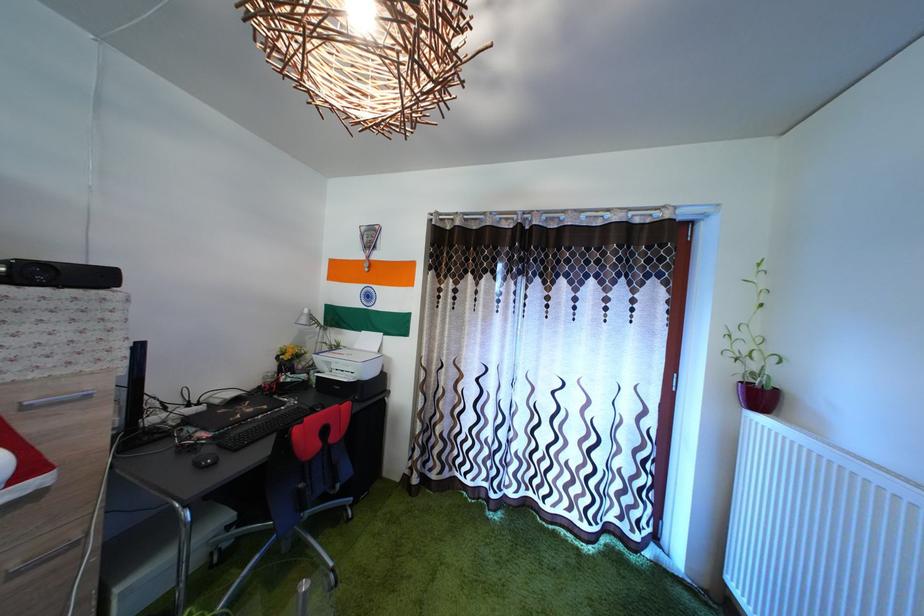
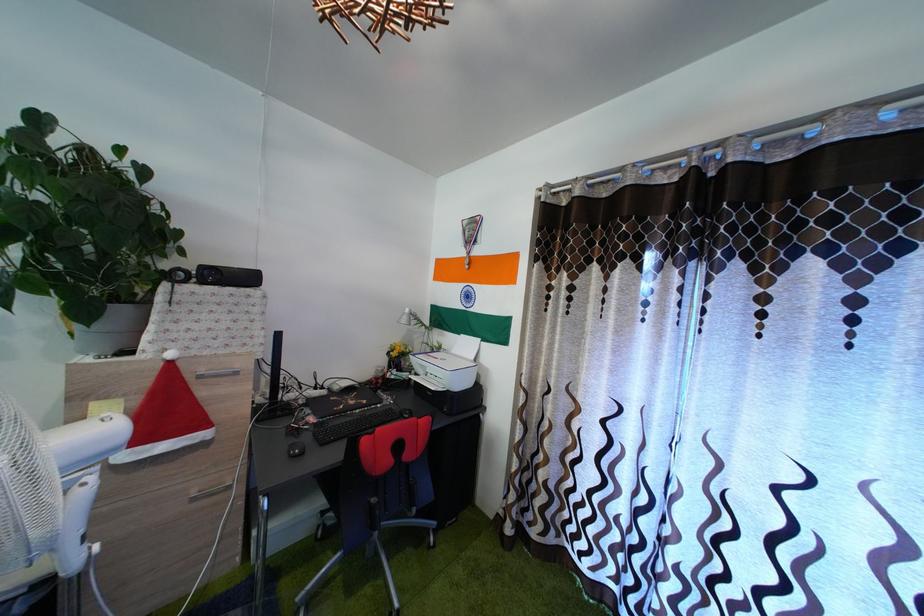
Question: The images are taken continuously from a first-person perspective. In which direction is your viewpoint rotating?

Choices:
 (A) Left
 (B) Right
 (C) Up
 (D) Down

Answer: (A)